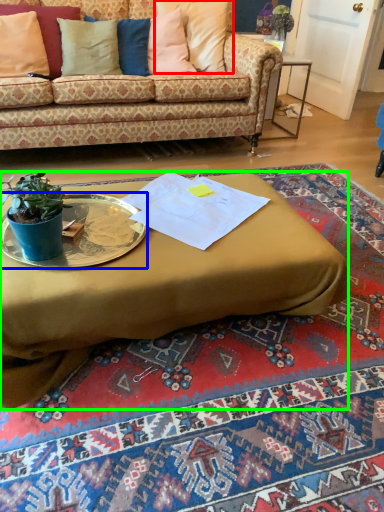
Question: Based on their relative distances, which object is farther from pillow (highlighted by a red box)? Choose from platter (highlighted by a blue box) and coffee table (highlighted by a green box).

Choices:
 (A) platter
 (B) coffee table

Answer: (A)